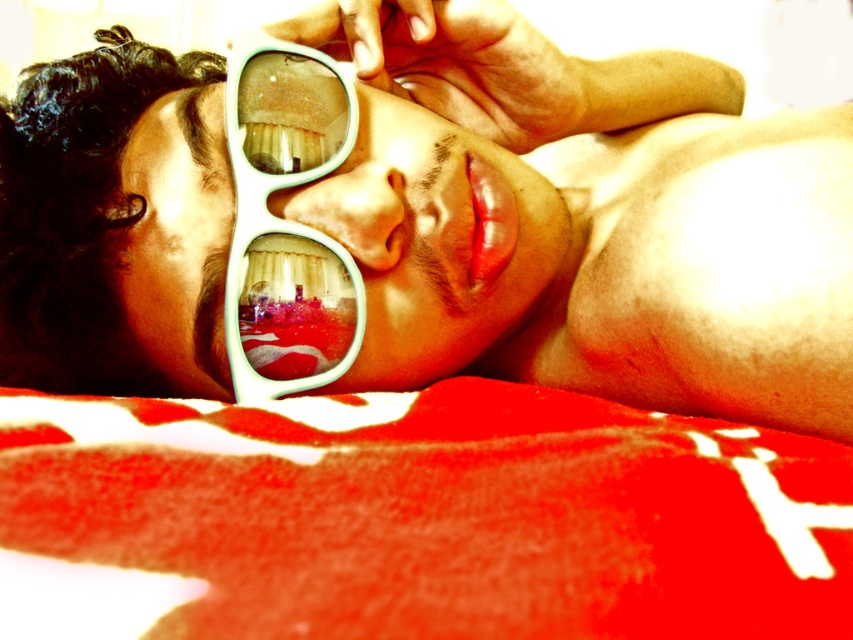
Is point (351, 227) farther from viewer compared to point (291, 330)?

No, it is in front of (291, 330).

Can you confirm if matte plastic sunglasses at upper center is wider than teal plastic sunglasses at center?

Correct, the width of matte plastic sunglasses at upper center exceeds that of teal plastic sunglasses at center.

I want to click on matte plastic sunglasses at upper center, so click(x=440, y=220).

Which of these two, red fuzzy blanket at lower center or teal plastic sunglasses at center, stands taller?

With more height is teal plastic sunglasses at center.

Between point (49, 397) and point (251, 273), which one is positioned behind?

Point (251, 273)

I want to click on red fuzzy blanket at lower center, so click(x=415, y=518).

Can you confirm if red fuzzy blanket at lower center is taller than teal plastic goggles at center?

No.

Does red fuzzy blanket at lower center appear on the right side of teal plastic goggles at center?

Correct, you'll find red fuzzy blanket at lower center to the right of teal plastic goggles at center.

Between point (791, 577) and point (250, 72), which one is positioned behind?

Positioned behind is point (250, 72).

You are a GUI agent. You are given a task and a screenshot of the screen. Output one action in this format:
    pyautogui.click(x=<x>, y=<y>)
    Task: Click on the red fuzzy blanket at lower center
    
    Given the screenshot: What is the action you would take?
    pyautogui.click(x=415, y=518)